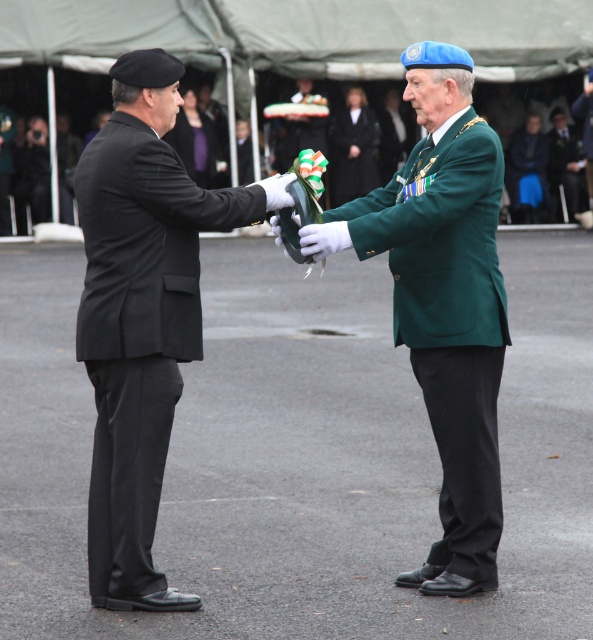
Based on the scene description, which object has a wider fabric? The blue fabric pants at lower right or the green fabric uniform at center?

The blue fabric pants at lower right might be wider than the green fabric uniform at center according to the description.

You are a photographer at this ceremony. You want to capture a photo of both the black matte suit at left and the green textured suit at center in the same frame. The camera you are using has a minimum focus distance of 28 inches. Will you be able to take the photo without moving either of the subjects?

The black matte suit at left and green textured suit at center are 28.47 inches apart from each other. Since the minimum focus distance is 28 inches, the photographer can capture both subjects in the same frame without moving them because the distance between them is slightly more than the required minimum focus distance.